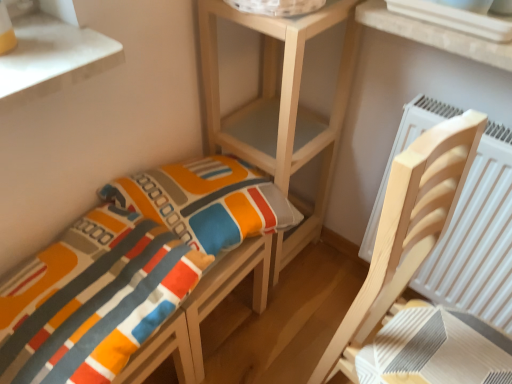
Question: Is the depth of textured fabric cushion at lower left, acting as the 2th furniture starting from the right, less than that of wooden shelf at center?

Choices:
 (A) yes
 (B) no

Answer: (A)

Question: Is textured fabric cushion at lower left, acting as the 2th furniture starting from the right, next to wooden shelf at center?

Choices:
 (A) no
 (B) yes

Answer: (A)

Question: From a real-world perspective, is textured fabric cushion at lower left, the 1th furniture in the left-to-right sequence, physically above wooden shelf at center?

Choices:
 (A) yes
 (B) no

Answer: (A)

Question: From the image's perspective, does textured fabric cushion at lower left, acting as the 2th furniture starting from the right, appear higher than wooden shelf at center?

Choices:
 (A) yes
 (B) no

Answer: (B)

Question: Can wooden shelf at center be found inside textured fabric cushion at lower left, acting as the 2th furniture starting from the right?

Choices:
 (A) no
 (B) yes

Answer: (A)

Question: In terms of width, does textured fabric cushion at lower left, acting as the 2th furniture starting from the right, look wider or thinner when compared to light wood chair at right, the 1th furniture in the right-to-left sequence?

Choices:
 (A) wide
 (B) thin

Answer: (A)

Question: Is point (258, 203) positioned closer to the camera than point (441, 221)?

Choices:
 (A) closer
 (B) farther

Answer: (B)

Question: From a real-world perspective, is textured fabric cushion at lower left, the 1th furniture in the left-to-right sequence, above or below light wood chair at right, acting as the 2th furniture starting from the left?

Choices:
 (A) above
 (B) below

Answer: (A)

Question: In the image, is textured fabric cushion at lower left, acting as the 2th furniture starting from the right, on the left side or the right side of light wood chair at right, the 1th furniture in the right-to-left sequence?

Choices:
 (A) left
 (B) right

Answer: (A)

Question: Considering the positions of wooden shelf at center and light wood chair at right, acting as the 2th furniture starting from the left, in the image, is wooden shelf at center bigger or smaller than light wood chair at right, acting as the 2th furniture starting from the left,?

Choices:
 (A) big
 (B) small

Answer: (B)

Question: In terms of height, does wooden shelf at center look taller or shorter compared to light wood chair at right, acting as the 2th furniture starting from the left?

Choices:
 (A) tall
 (B) short

Answer: (A)

Question: Which is correct: wooden shelf at center is inside light wood chair at right, acting as the 2th furniture starting from the left, or outside of it?

Choices:
 (A) inside
 (B) outside

Answer: (B)

Question: From the image's perspective, relative to light wood chair at right, acting as the 2th furniture starting from the left, is wooden shelf at center above or below?

Choices:
 (A) below
 (B) above

Answer: (B)

Question: Looking at the image, does textured fabric cushion at lower left, the 1th furniture in the left-to-right sequence, seem bigger or smaller compared to wooden shelf at center?

Choices:
 (A) big
 (B) small

Answer: (B)

Question: Is point (13, 304) positioned closer to the camera than point (202, 87)?

Choices:
 (A) closer
 (B) farther

Answer: (A)